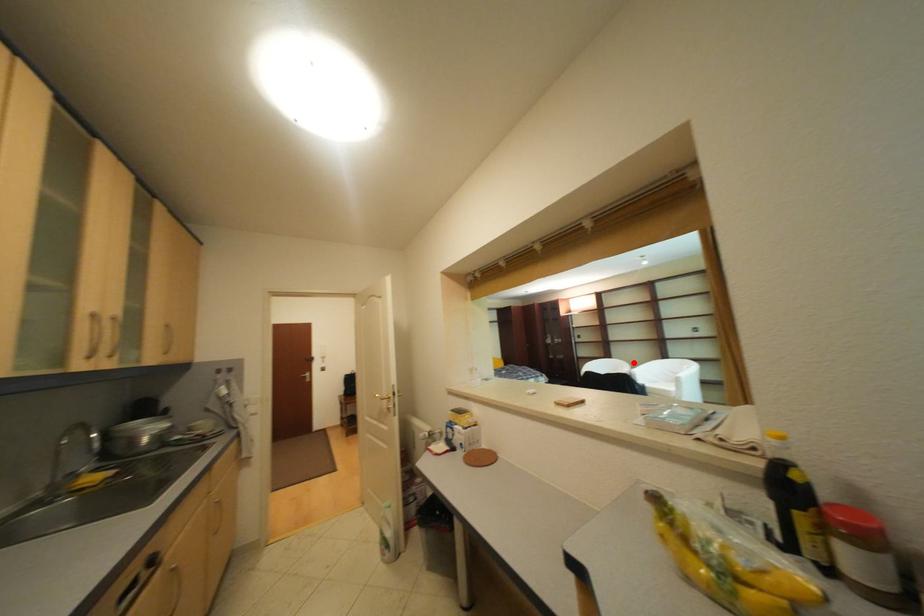
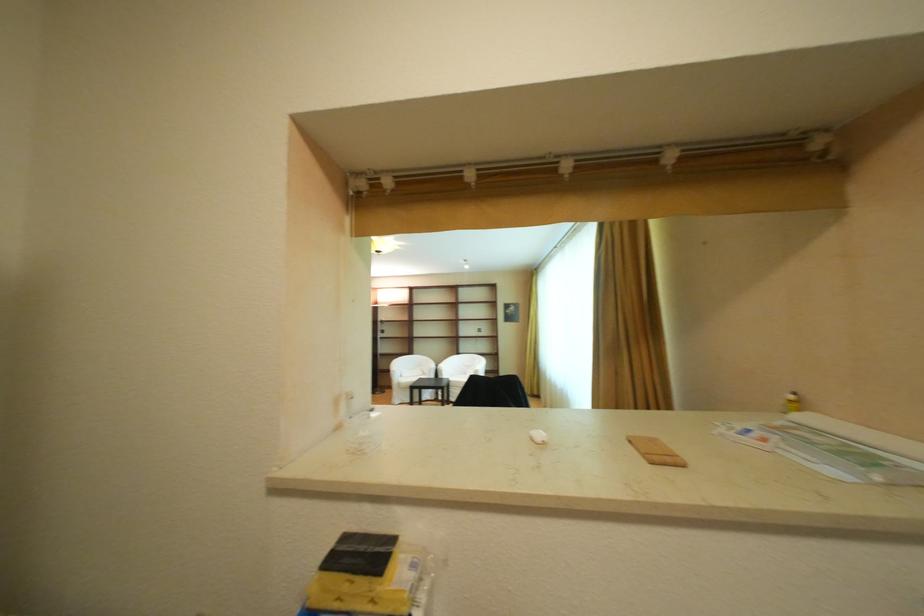
In the second image, find the point that corresponds to the highlighted location in the first image.

(436, 359)